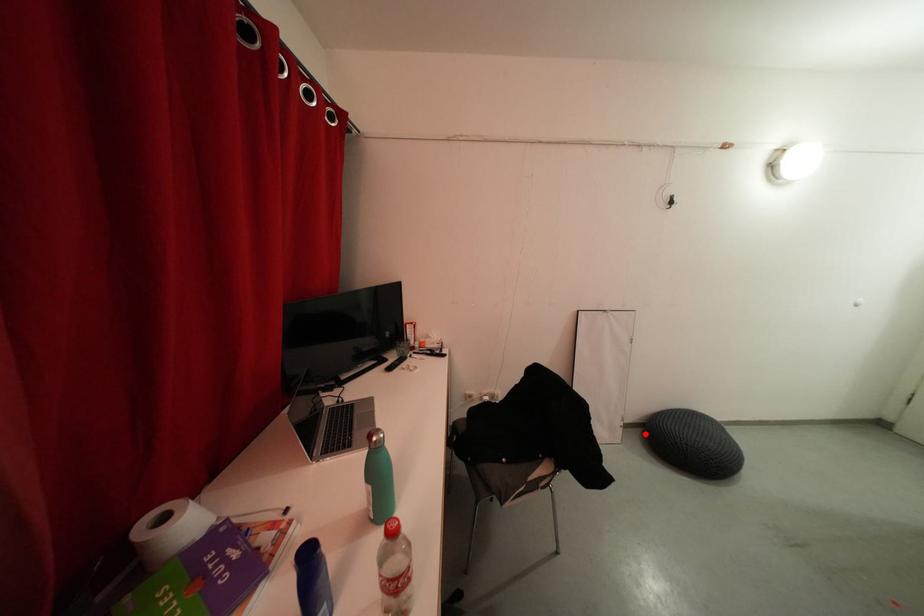
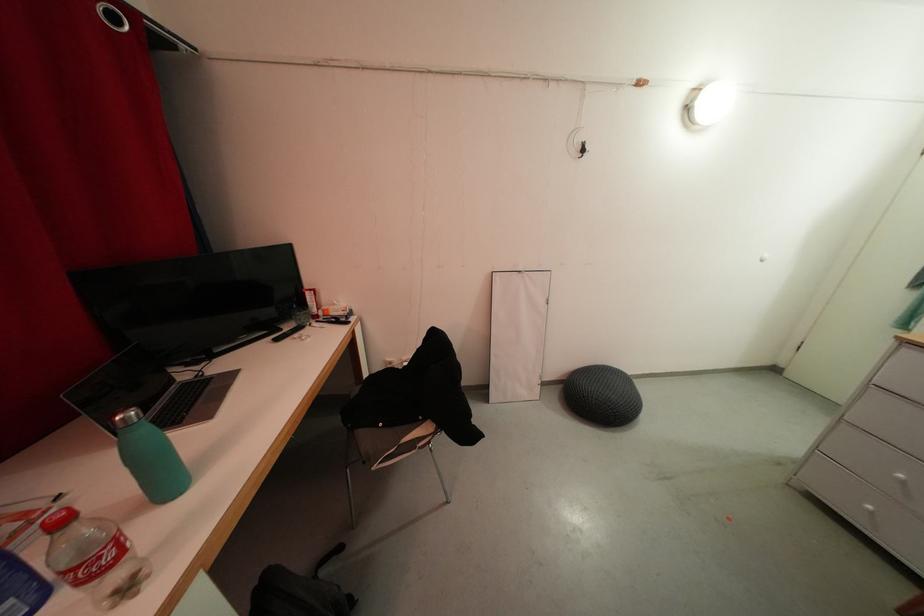
Question: I am providing you with two images of the same scene from different viewpoints. Given a red point in image1, look at the same physical point in image2. Is it:

Choices:
 (A) Closer to the viewpoint
 (B) Farther from the viewpoint

Answer: (B)